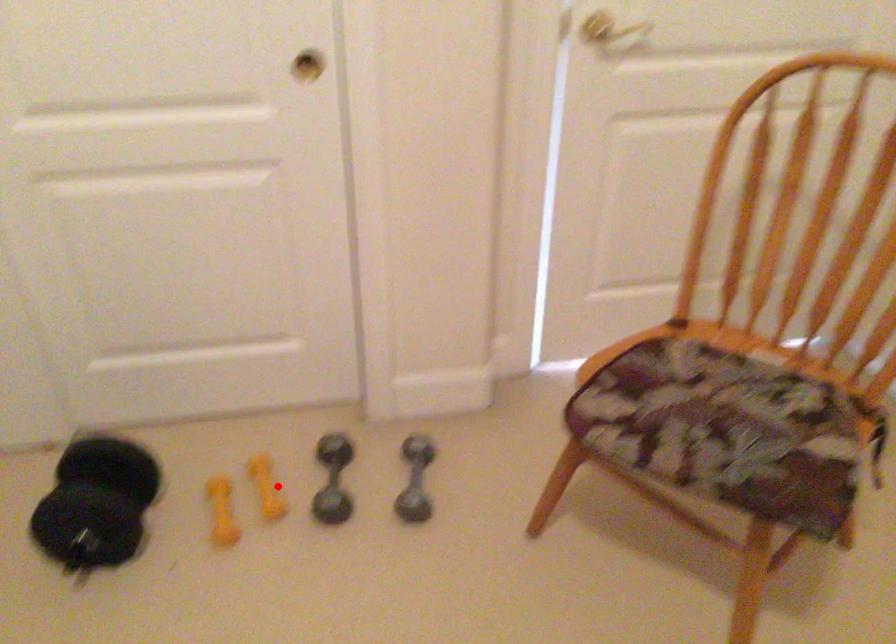
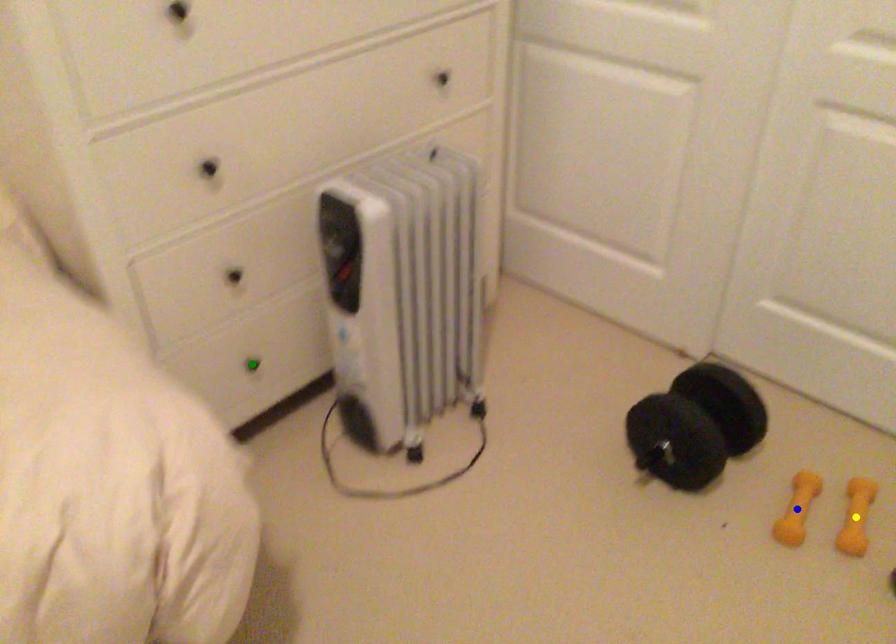
Question: I am providing you with two images of the same scene from different viewpoints. A red point is marked on the first image. You are given multiple points on the second image. Which mark in image 2 goes with the point in image 1?

Choices:
 (A) blue point
 (B) yellow point
 (C) green point

Answer: (B)